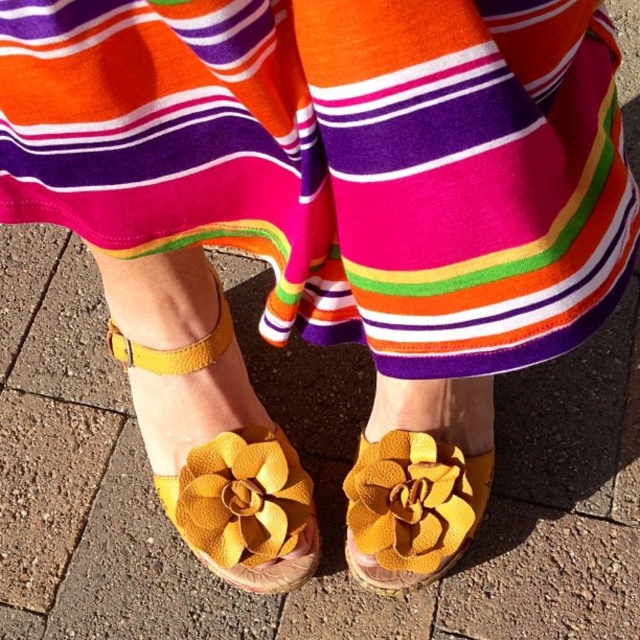
Question: Among these objects, which one is nearest to the camera?

Choices:
 (A) leather flower at center
 (B) suede/yellow flower at center
 (C) matte yellow flower at center

Answer: (B)

Question: Observing the image, what is the correct spatial positioning of suede/yellow flower at center in reference to matte yellow flower at center?

Choices:
 (A) left
 (B) right

Answer: (A)

Question: Does leather flower at center have a greater width compared to matte yellow flower at center?

Choices:
 (A) no
 (B) yes

Answer: (A)

Question: Which object appears farthest from the camera in this image?

Choices:
 (A) matte yellow flower at center
 (B) leather flower at center
 (C) suede/yellow flower at center

Answer: (A)

Question: Can you confirm if suede/yellow flower at center is bigger than leather flower at center?

Choices:
 (A) no
 (B) yes

Answer: (B)

Question: Estimate the real-world distances between objects in this image. Which object is closer to the matte yellow flower at center?

Choices:
 (A) suede/yellow flower at center
 (B) leather flower at center

Answer: (A)